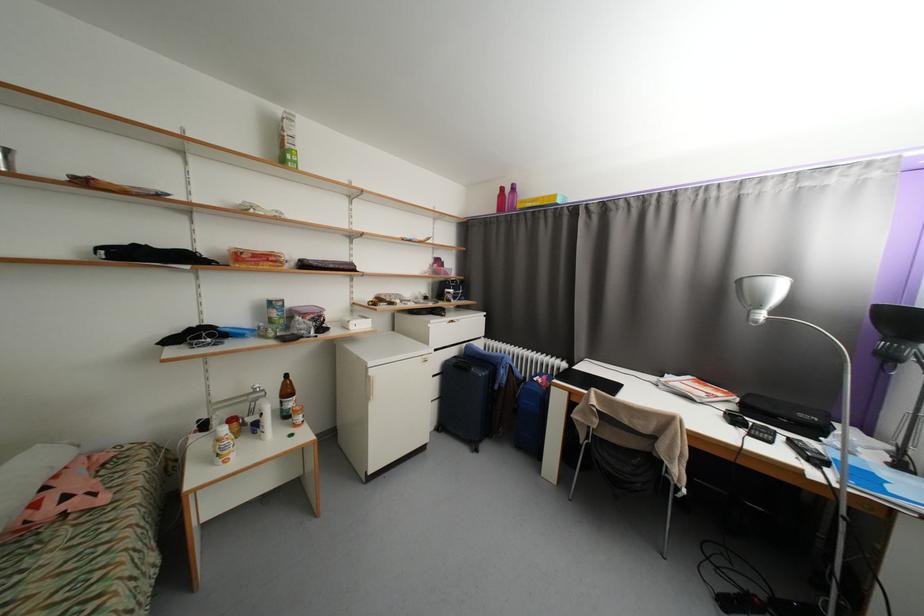
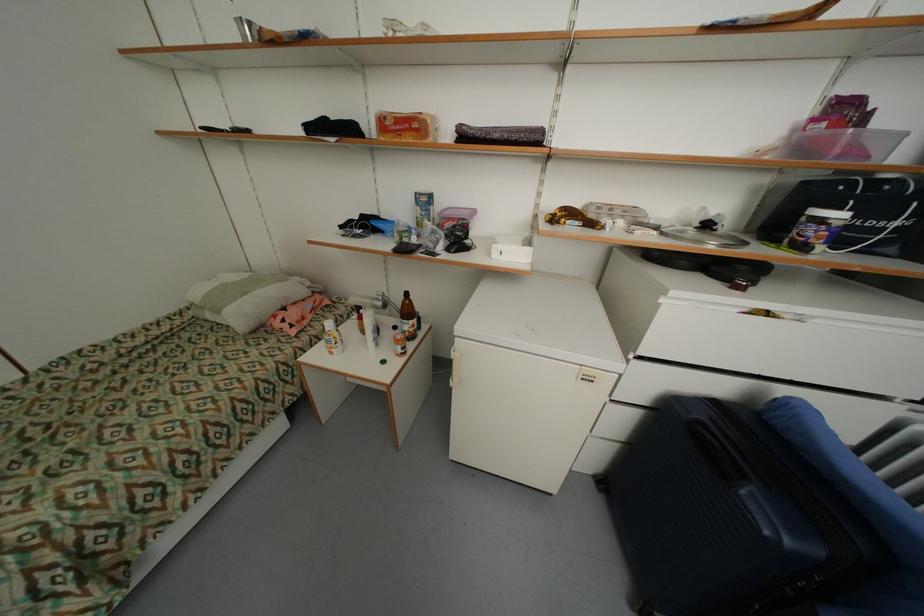
Find the pixel in the second image that matches point 125,476 in the first image.

(327, 320)